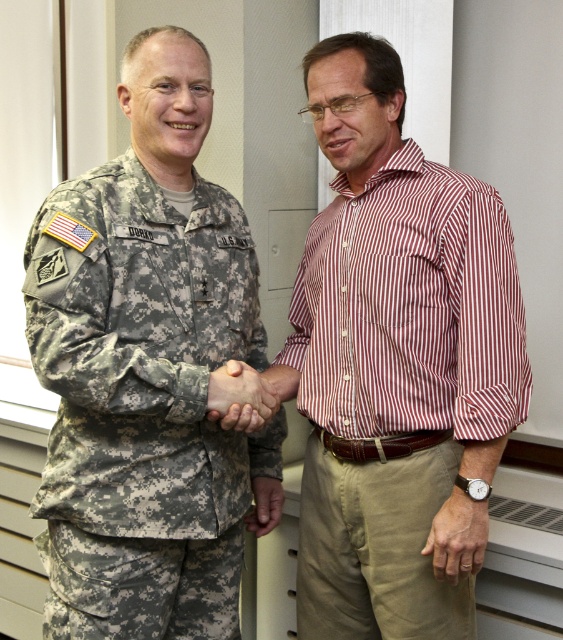
You are an observer in the scene. You see the striped cotton shirt at center and the camouflage fabric uniform at left. Which object is positioned to the right of the other?

The striped cotton shirt at center is to the right of the camouflage fabric uniform at left.

You are a tailor who needs to determine which clothing item requires more fabric to make between the striped cotton shirt at center and the camouflage fabric uniform at left. Which one would need more fabric?

The striped cotton shirt at center is bigger than the camouflage fabric uniform at left, so it would require more fabric to make.